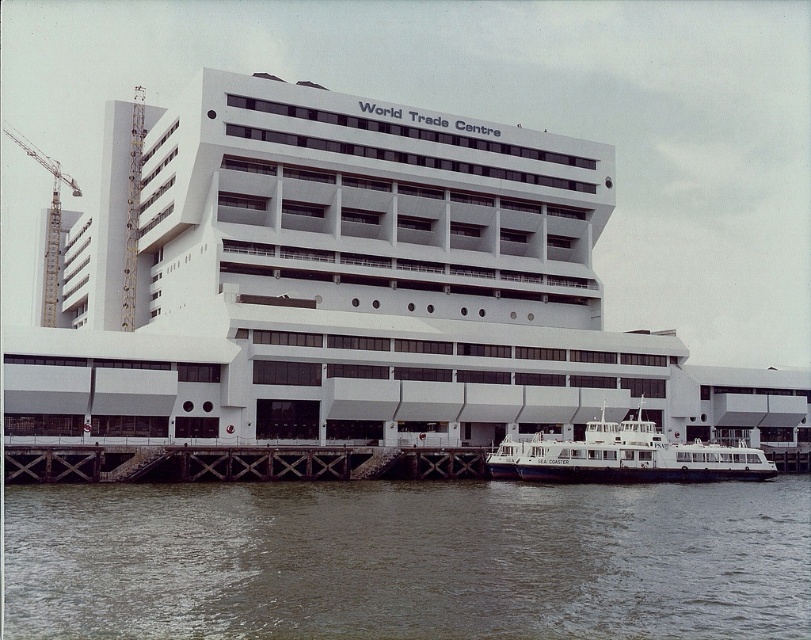
Can you confirm if white glossy boat at lower center is taller than metallic construction crane at left?

No, white glossy boat at lower center is not taller than metallic construction crane at left.

Which is in front, point (704, 468) or point (58, 243)?

Point (704, 468) is more forward.

Find the location of a particular element. This screenshot has height=640, width=811. white glossy boat at lower center is located at coordinates (625, 456).

Does point (595, 522) come behind point (39, 156)?

That is False.

This screenshot has height=640, width=811. I want to click on brown murky water at lower center, so click(x=406, y=561).

Consider the image. Does brown wooden dock at lower center appear on the left side of metallic construction crane at left?

No, brown wooden dock at lower center is not to the left of metallic construction crane at left.

Between point (320, 467) and point (58, 164), which one is positioned behind?

The point (58, 164) is behind.

At what (x,y) coordinates should I click in order to perform the action: click on brown wooden dock at lower center. Please return your answer as a coordinate pair (x, y). This screenshot has width=811, height=640. Looking at the image, I should click on (235, 464).